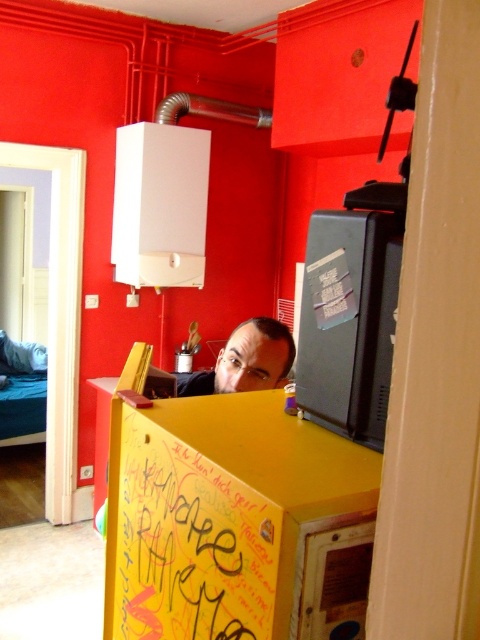
You are standing in the room with the yellow cabinet and want to hang a picture on the wall. There are two points marked on the wall at coordinates point [191,516] and point [372,298]. Which point is closer to you so you can reach it easily?

Point [191,516] is closer to the viewer than point [372,298], so you can reach it easily.

You are a delivery person who needs to hang a new sign that is the same size as the yellow paperboard sign at center. You have a space above the matte black monitor at upper right that is 1.2 meters tall. Will the new sign fit vertically in this space?

The yellow paperboard sign at center is not as tall as the matte black monitor at upper right. Since the space above the matte black monitor at upper right is 1.2 meters tall, the new sign, being shorter than the monitor, will fit vertically in the space.